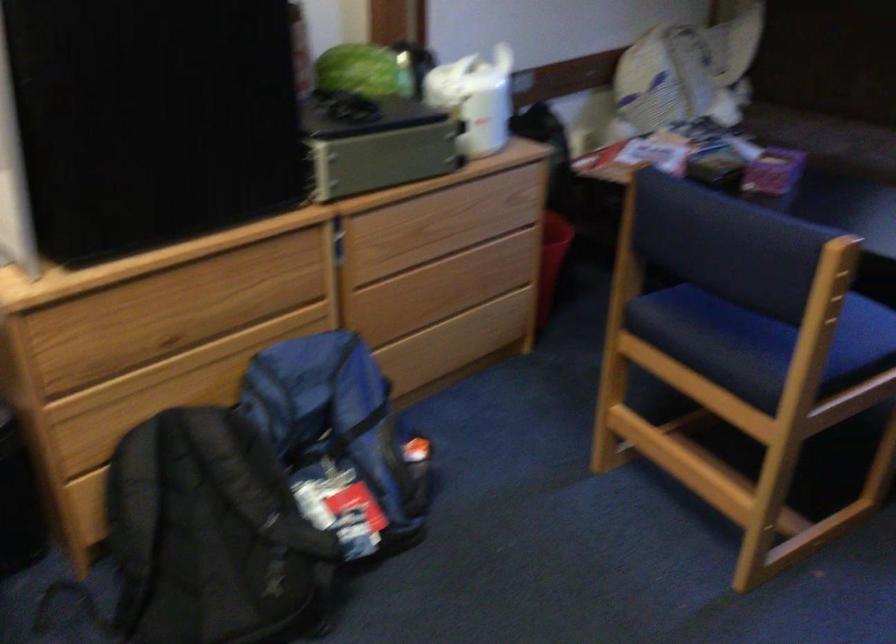
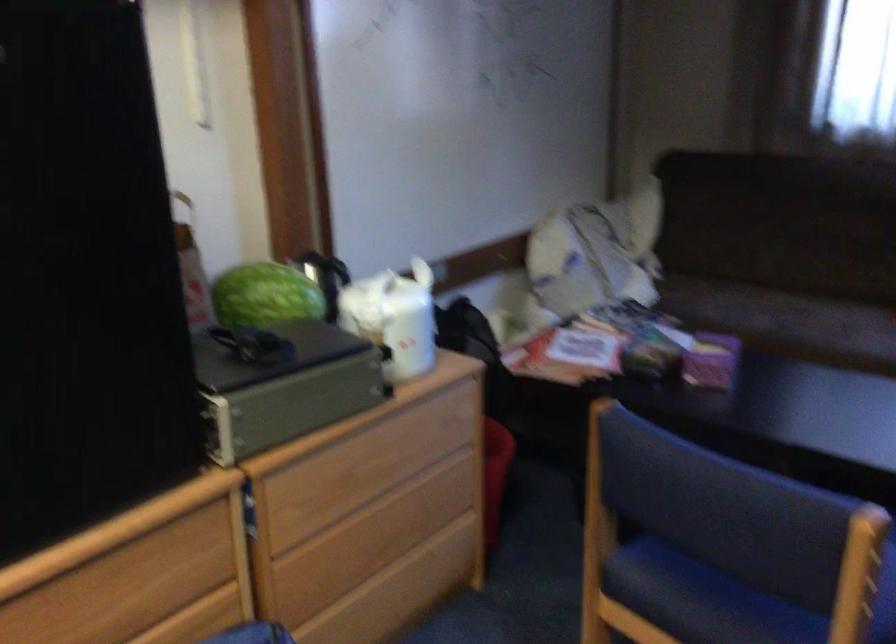
In the second image, find the point that corresponds to point (319, 169) in the first image.

(222, 433)